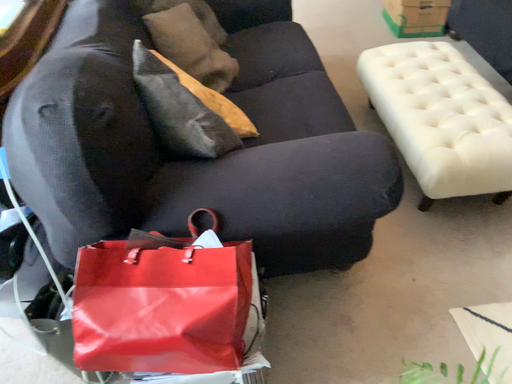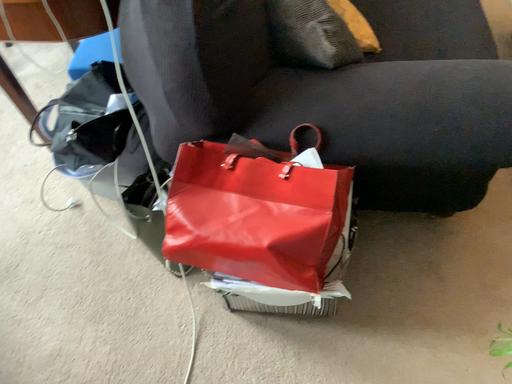
Question: How did the camera likely rotate when shooting the video?

Choices:
 (A) rotated left
 (B) rotated right

Answer: (A)